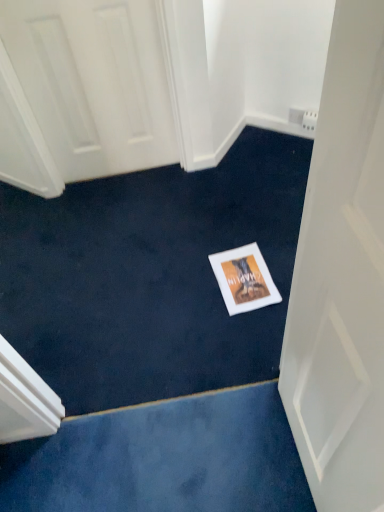
This screenshot has width=384, height=512. Find the location of `white matte postcard at center`. white matte postcard at center is located at coordinates (244, 279).

What do you see at coordinates (244, 279) in the screenshot? I see `white matte postcard at center` at bounding box center [244, 279].

Where is `white matte door at center`? The height and width of the screenshot is (512, 384). white matte door at center is located at coordinates (342, 277).

What do you see at coordinates (342, 277) in the screenshot?
I see `white matte door at center` at bounding box center [342, 277].

Image resolution: width=384 pixels, height=512 pixels. I want to click on white matte postcard at center, so click(x=244, y=279).

Does white matte postcard at center appear on the right side of white matte door at center?

No.

Which is in front, white matte postcard at center or white matte door at center?

white matte door at center is closer to the camera.

Is point (276, 296) closer or farther from the camera than point (346, 464)?

Point (276, 296) is farther from the camera than point (346, 464).

From the image's perspective, would you say white matte postcard at center is shown under white matte door at center?

No, from the image's perspective, white matte postcard at center is not below white matte door at center.

From a real-world perspective, which is physically below, white matte postcard at center or white matte door at center?

white matte postcard at center.

Consider the image. Considering the relative sizes of white matte postcard at center and white matte door at center in the image provided, is white matte postcard at center wider than white matte door at center?

Indeed, white matte postcard at center has a greater width compared to white matte door at center.

Who is shorter, white matte postcard at center or white matte door at center?

Standing shorter between the two is white matte postcard at center.

Is white matte postcard at center bigger than white matte door at center?

Actually, white matte postcard at center might be smaller than white matte door at center.

Is white matte door at center a part of white matte postcard at center?

No, white matte door at center is not surrounded by white matte postcard at center.

Are white matte postcard at center and white matte door at center far apart?

white matte postcard at center is actually quite close to white matte door at center.

Is white matte postcard at center oriented away from white matte door at center?

No, white matte postcard at center is not facing away from white matte door at center.

What's the angular difference between white matte postcard at center and white matte door at center's facing directions?

The facing directions of white matte postcard at center and white matte door at center are 93.9 degrees apart.

Consider the image. Measure the distance from white matte postcard at center to white matte door at center.

white matte postcard at center and white matte door at center are 31.00 inches apart.

Where is `postcard that appears on the left of white matte door at center`? This screenshot has height=512, width=384. postcard that appears on the left of white matte door at center is located at coordinates (244, 279).

Is white matte door at center to the left or to the right of white matte postcard at center in the image?

Clearly, white matte door at center is on the right of white matte postcard at center in the image.

Considering the relative positions of white matte door at center and white matte postcard at center in the image provided, is white matte door at center in front of white matte postcard at center?

Yes, it is.

Which is closer, (336, 312) or (267, 288)?

The point (336, 312) is more forward.

From the image's perspective, is white matte door at center located above or below white matte postcard at center?

From the image's perspective, white matte door at center appears below white matte postcard at center.

From a real-world perspective, which is physically above, white matte door at center or white matte postcard at center?

white matte door at center is physically above.

Considering the sizes of objects white matte door at center and white matte postcard at center in the image provided, who is thinner, white matte door at center or white matte postcard at center?

With smaller width is white matte door at center.

Can you confirm if white matte door at center is taller than white matte postcard at center?

Indeed, white matte door at center has a greater height compared to white matte postcard at center.

Between white matte door at center and white matte postcard at center, which one has larger size?

With larger size is white matte door at center.

Consider the image. Would you say white matte door at center is inside or outside white matte postcard at center?

white matte door at center is not enclosed by white matte postcard at center.

Is white matte door at center not close to white matte postcard at center?

No, there isn't a large distance between white matte door at center and white matte postcard at center.

Is white matte door at center aimed at white matte postcard at center?

No, white matte door at center is not turned towards white matte postcard at center.

Measure the distance between white matte door at center and white matte postcard at center.

They are 31.00 inches apart.

I want to click on door below the white matte postcard at center (from the image's perspective), so click(342, 277).

Locate an element on the screen. This screenshot has height=512, width=384. postcard on the left of white matte door at center is located at coordinates (244, 279).

You are a GUI agent. You are given a task and a screenshot of the screen. Output one action in this format:
    pyautogui.click(x=<x>, y=<y>)
    Task: Click on the postcard behind the white matte door at center
    
    Given the screenshot: What is the action you would take?
    pyautogui.click(x=244, y=279)